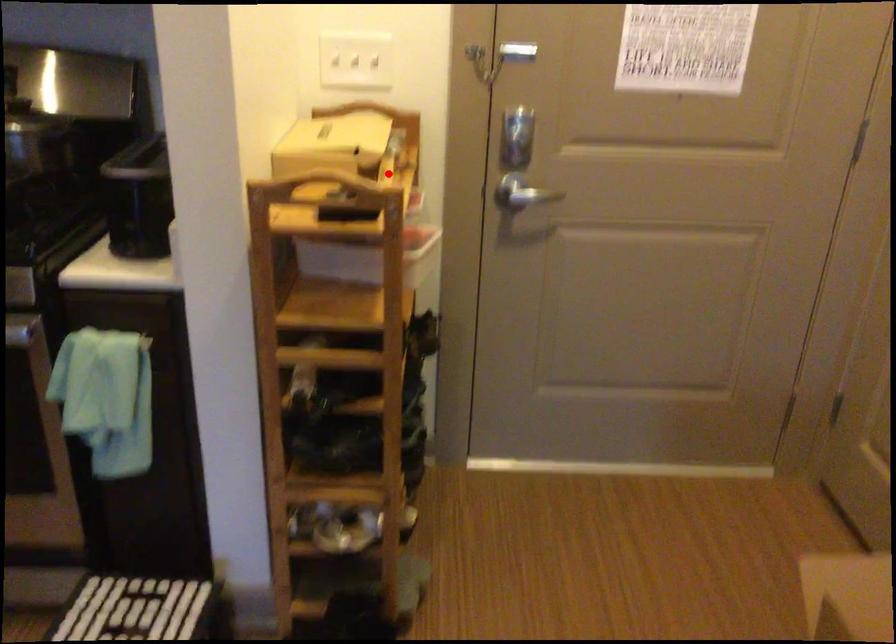
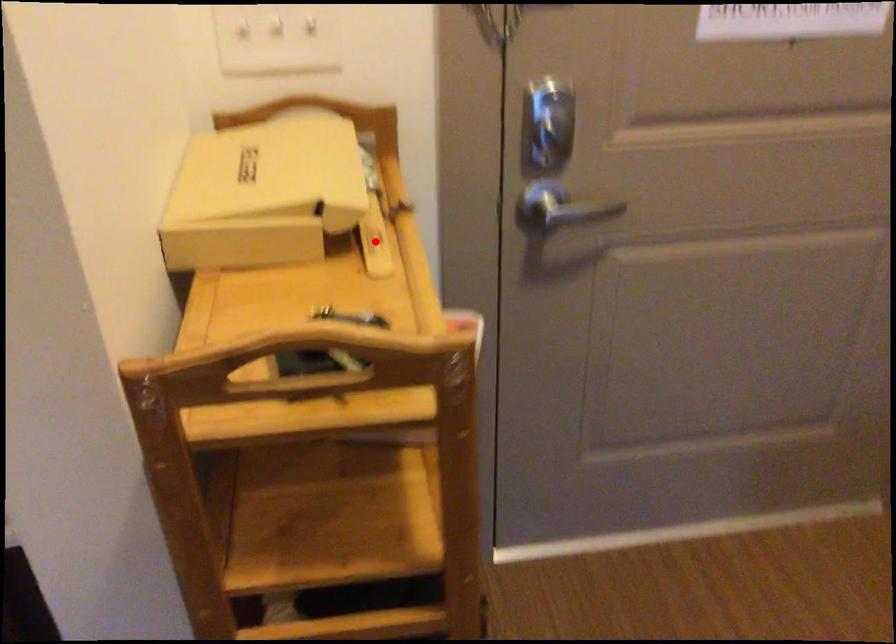
I am providing you with two images of the same scene from different viewpoints. A red point is marked on the first image and another point is marked on the second image. Is the red point in image1 aligned with the point shown in image2?

Yes